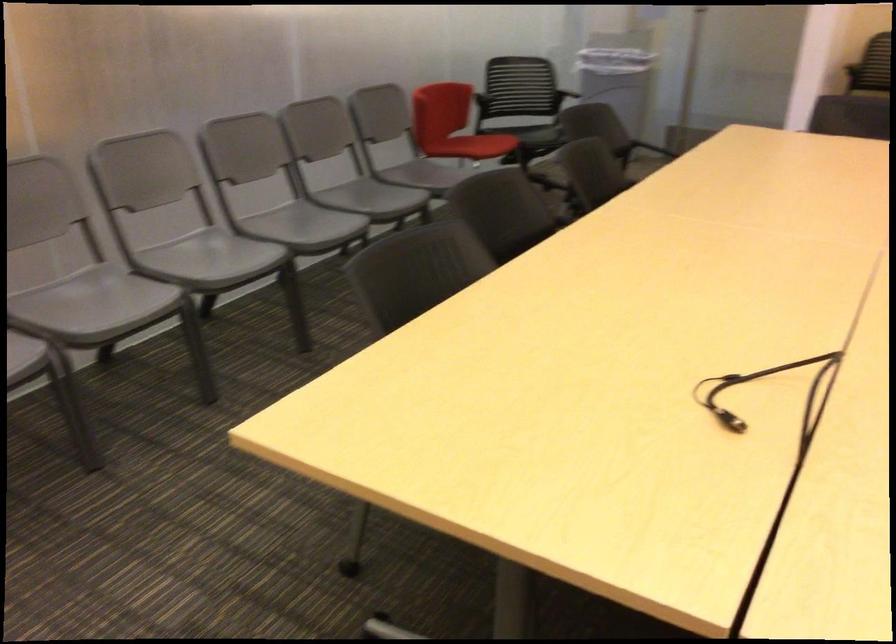
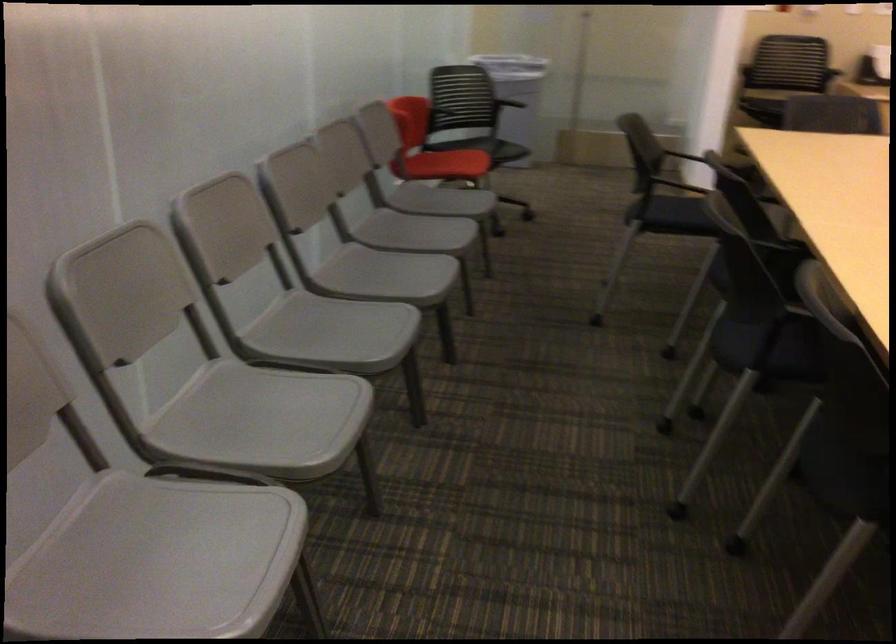
The point at [108,304] is marked in the first image. Where is the corresponding point in the second image?

(263, 420)